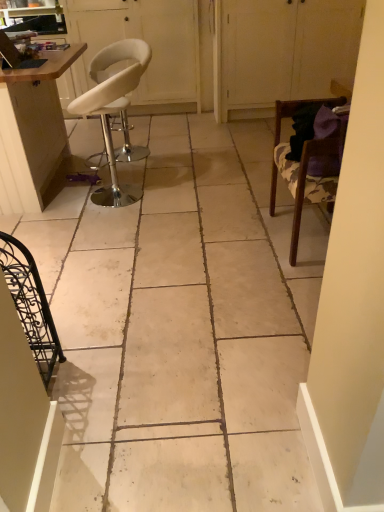
Where is `vacant space that is in between white leather stool at left, the 2th chair from the right, and black wrought iron chair at lower left, the 1th chair from the left`? This screenshot has height=512, width=384. vacant space that is in between white leather stool at left, the 2th chair from the right, and black wrought iron chair at lower left, the 1th chair from the left is located at coordinates (94, 263).